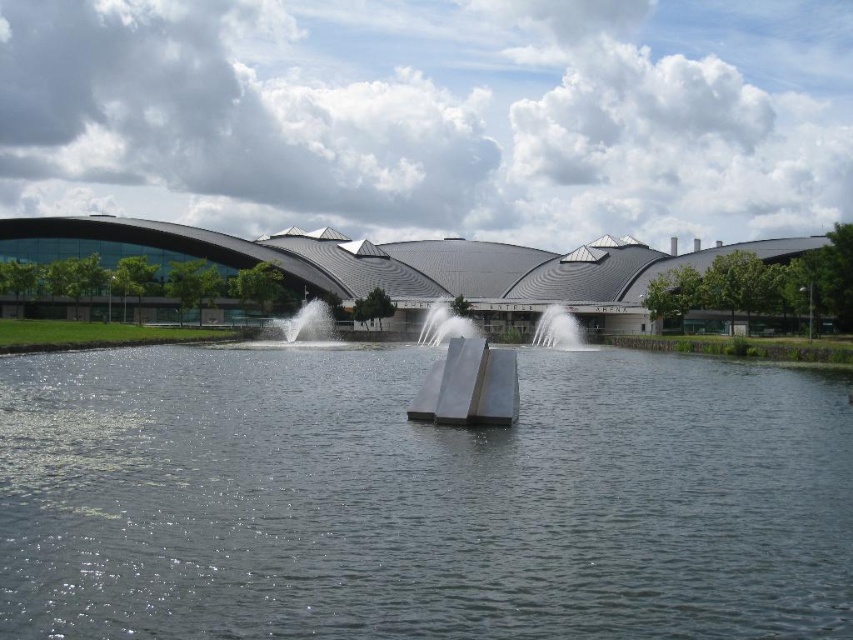
Question: Which point is farther from the camera taking this photo?

Choices:
 (A) (532, 344)
 (B) (640, 381)

Answer: (A)

Question: Considering the relative positions of clear water at center and silver metallic fountain at center in the image provided, where is clear water at center located with respect to silver metallic fountain at center?

Choices:
 (A) left
 (B) right

Answer: (A)

Question: Which of the following is the closest to the observer?

Choices:
 (A) (566, 348)
 (B) (660, 506)

Answer: (B)

Question: Which of the following is the farthest from the observer?

Choices:
 (A) (558, 310)
 (B) (495, 612)

Answer: (A)

Question: Is clear water at center to the left of silver metallic fountain at center from the viewer's perspective?

Choices:
 (A) no
 (B) yes

Answer: (B)

Question: Can you confirm if clear water at center is positioned above silver metallic fountain at center?

Choices:
 (A) yes
 (B) no

Answer: (B)